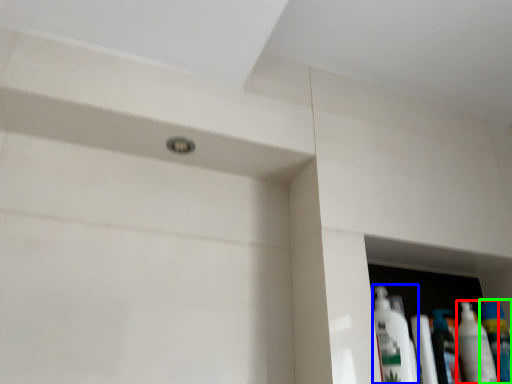
Question: Which is farther away from cleaning product (highlighted by a red box)? cleaning product (highlighted by a blue box) or mouthwash (highlighted by a green box)?

Choices:
 (A) cleaning product
 (B) mouthwash

Answer: (A)